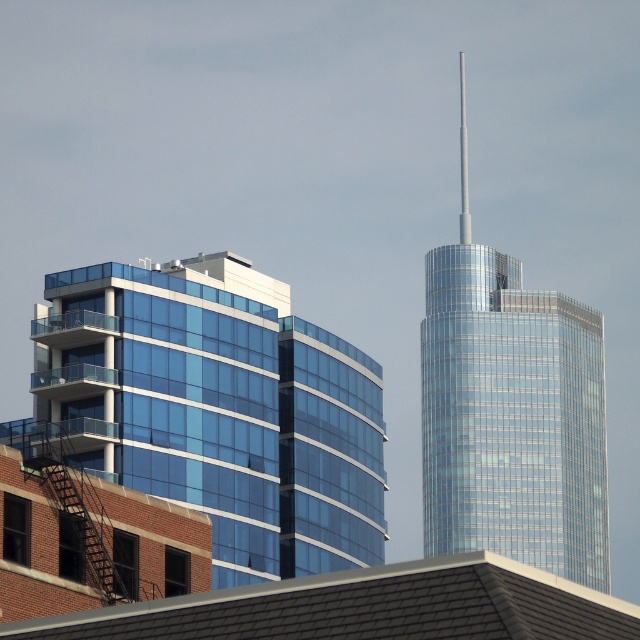
Is transparent glass building at left smaller than shiny glass tower at right?

Indeed, transparent glass building at left has a smaller size compared to shiny glass tower at right.

Which is in front, point (308, 435) or point (604, 483)?

Point (308, 435) is in front.

You are a GUI agent. You are given a task and a screenshot of the screen. Output one action in this format:
    pyautogui.click(x=<x>, y=<y>)
    Task: Click on the transparent glass building at left
    This screenshot has width=640, height=640.
    Given the screenshot: What is the action you would take?
    pyautogui.click(x=214, y=410)